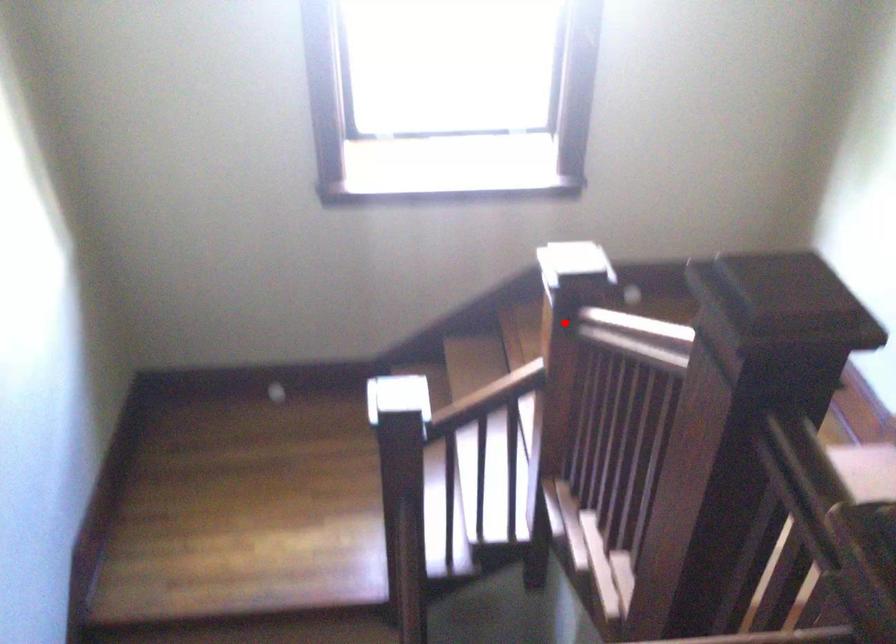
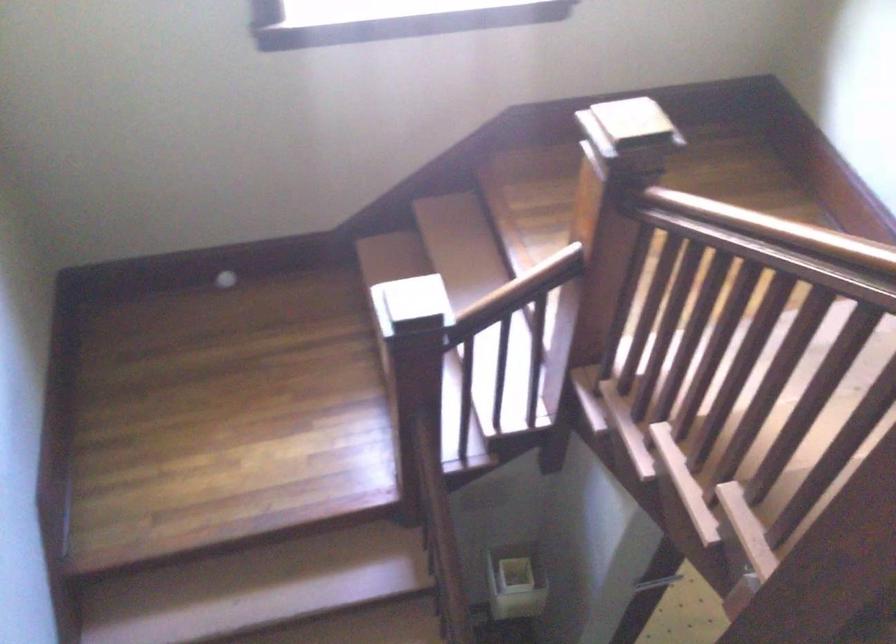
Question: I am providing you with two images of the same scene from different viewpoints. Image1 has a red point marked. In image2, the corresponding 3D location appears at what relative position? Reply with the corresponding letter.

Choices:
 (A) Closer
 (B) Farther

Answer: (A)